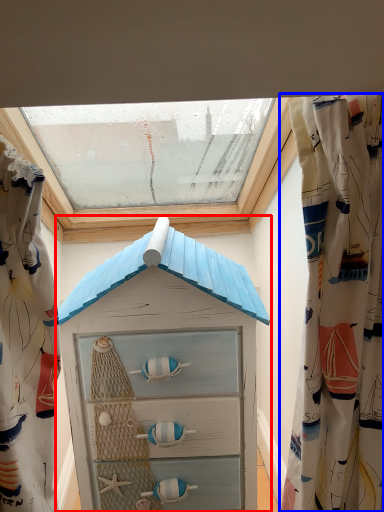
Question: Which object is closer to the camera taking this photo, beach hut (highlighted by a red box) or curtain (highlighted by a blue box)?

Choices:
 (A) beach hut
 (B) curtain

Answer: (B)